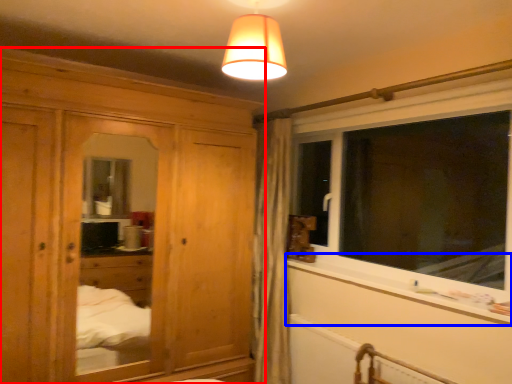
Question: Which object is further to the camera taking this photo, cabinetry (highlighted by a red box) or window sill (highlighted by a blue box)?

Choices:
 (A) cabinetry
 (B) window sill

Answer: (A)